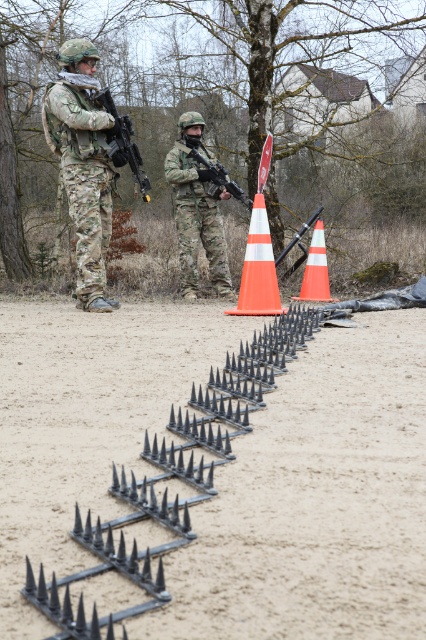
Question: Does camouflage fabric uniform at center come behind matte black rifle at upper left?

Choices:
 (A) no
 (B) yes

Answer: (B)

Question: Does black metal spikes at center come behind matte black rifle at center?

Choices:
 (A) yes
 (B) no

Answer: (B)

Question: Estimate the real-world distances between objects in this image. Which object is closer to the matte black rifle at upper left?

Choices:
 (A) matte black rifle at center
 (B) orange/white traffic cone at center
 (C) camouflage fabric uniform at center
 (D) orange plastic traffic cone at center

Answer: (D)

Question: Which point appears farthest from the camera in this image?

Choices:
 (A) (227, 173)
 (B) (294, 456)

Answer: (A)

Question: Is the position of black metal spikes at center more distant than that of matte black rifle at upper left?

Choices:
 (A) yes
 (B) no

Answer: (B)

Question: Among these points, which one is farthest from the camera?

Choices:
 (A) (196, 326)
 (B) (261, 298)
 (C) (141, 192)
 (D) (204, 147)

Answer: (C)